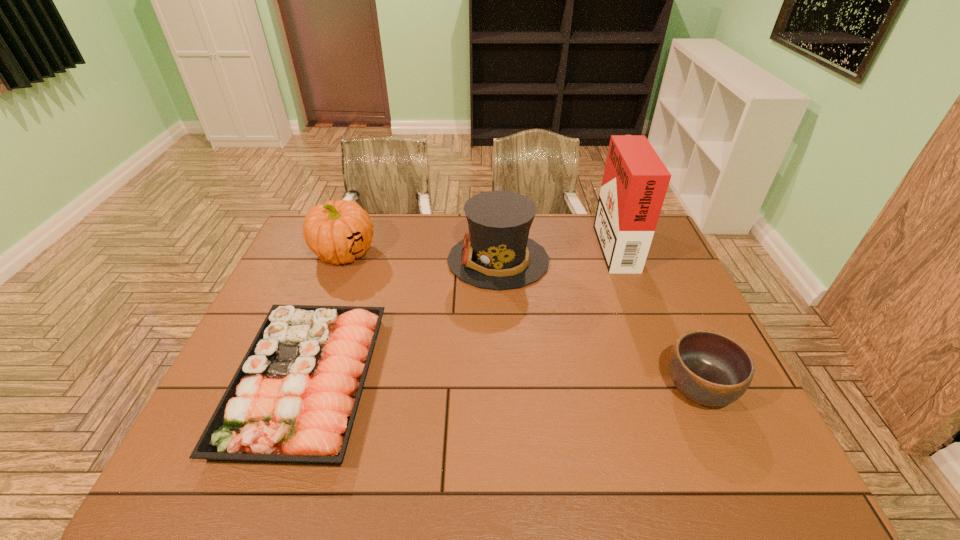
The height and width of the screenshot is (540, 960). What are the coordinates of `cigarette case that is positioned at the right edge` in the screenshot? It's located at (635, 181).

You are a GUI agent. You are given a task and a screenshot of the screen. Output one action in this format:
    pyautogui.click(x=<x>, y=<y>)
    Task: Click on the bowl at the right edge
    Image resolution: width=960 pixels, height=540 pixels.
    Given the screenshot: What is the action you would take?
    pyautogui.click(x=709, y=368)

The height and width of the screenshot is (540, 960). Find the location of `object at the far left corner`. object at the far left corner is located at coordinates (337, 232).

The width and height of the screenshot is (960, 540). In order to click on object present at the near left corner in this screenshot , I will do `click(293, 399)`.

Image resolution: width=960 pixels, height=540 pixels. I want to click on object at the far right corner, so click(x=635, y=181).

This screenshot has width=960, height=540. Find the location of `vacant region at the far edge of the desktop`. vacant region at the far edge of the desktop is located at coordinates (588, 222).

In the image, there is a desktop. Identify the location of vacant region at the near edge. This screenshot has height=540, width=960. (389, 460).

At what (x,y) coordinates should I click in order to perform the action: click on vacant space at the left edge. Please return your answer as a coordinate pair (x, y). This screenshot has height=540, width=960. Looking at the image, I should click on (267, 309).

This screenshot has width=960, height=540. Find the location of `free space at the right edge`. free space at the right edge is located at coordinates (668, 295).

Identify the location of free point between the fourth tallest object and the pumpkin. The height and width of the screenshot is (540, 960). (521, 320).